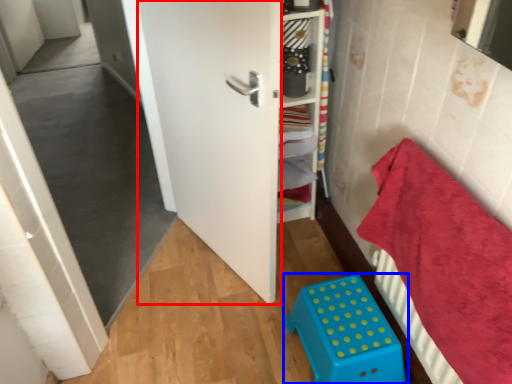
Question: Which of the following is the closest to the observer, door (highlighted by a red box) or furniture (highlighted by a blue box)?

Choices:
 (A) door
 (B) furniture

Answer: (A)